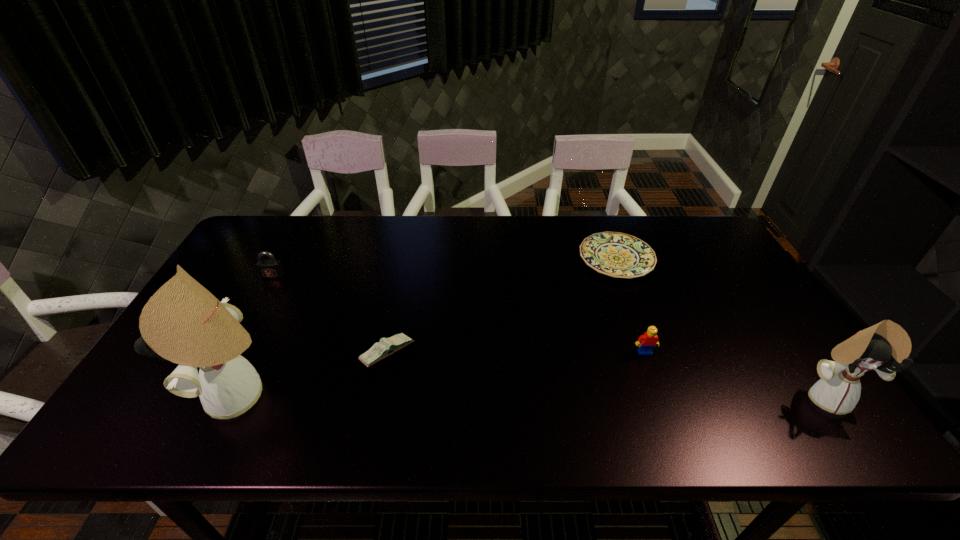
Identify the location of object that is at the near right corner. The height and width of the screenshot is (540, 960). (882, 347).

Locate an element on the screen. vacant area at the far edge is located at coordinates (441, 254).

Locate an element on the screen. vacant space at the near edge of the desktop is located at coordinates (364, 382).

You are a GUI agent. You are given a task and a screenshot of the screen. Output one action in this format:
    pyautogui.click(x=<x>, y=<y>)
    Task: Click on the vacant space at the right edge of the desktop
    The image size is (960, 540).
    Given the screenshot: What is the action you would take?
    pyautogui.click(x=695, y=265)

Find the location of a particular element. The image size is (960, 540). free space at the far left corner is located at coordinates (276, 241).

This screenshot has width=960, height=540. In order to click on vacant area at the far right corner in this screenshot , I will do click(x=688, y=235).

Find the location of a particular element. vacant region between the fifth tallest object and the right doll is located at coordinates (607, 375).

You are a GUI agent. You are given a task and a screenshot of the screen. Output one action in this format:
    pyautogui.click(x=<x>, y=<y>)
    Task: Click on the vacant point located between the padlock and the second shortest object
    This screenshot has width=960, height=540.
    Given the screenshot: What is the action you would take?
    pyautogui.click(x=330, y=314)

This screenshot has width=960, height=540. Find the location of `vacant space in between the Lego and the rightmost object`. vacant space in between the Lego and the rightmost object is located at coordinates [735, 375].

Locate an element on the screen. This screenshot has height=540, width=960. vacant space that is in between the plate and the left doll is located at coordinates (429, 327).